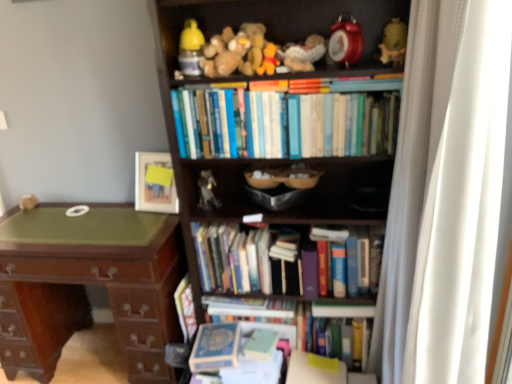
Where is `vacant area that is in front of white plush toy at left, the 1th toy when ordered from left to right`? The width and height of the screenshot is (512, 384). vacant area that is in front of white plush toy at left, the 1th toy when ordered from left to right is located at coordinates (24, 218).